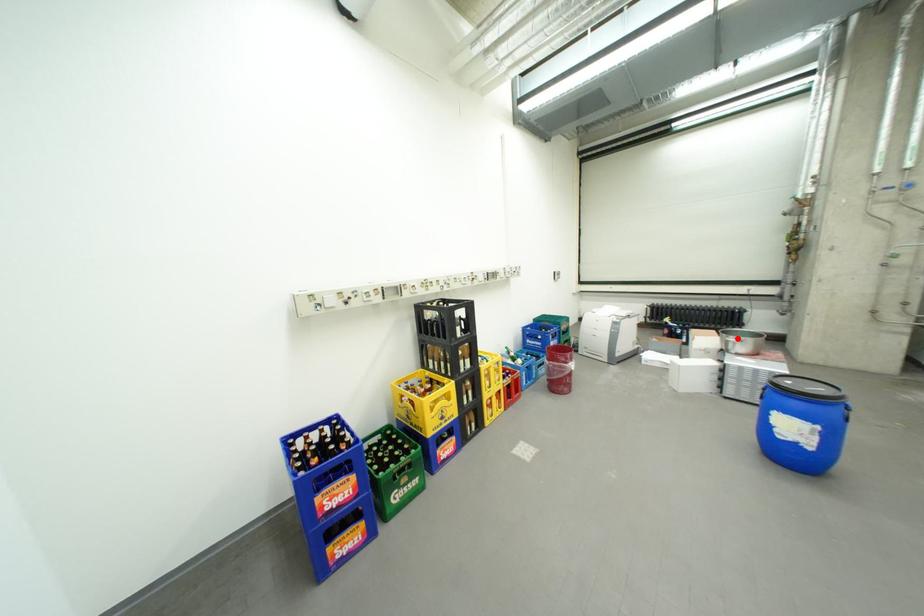
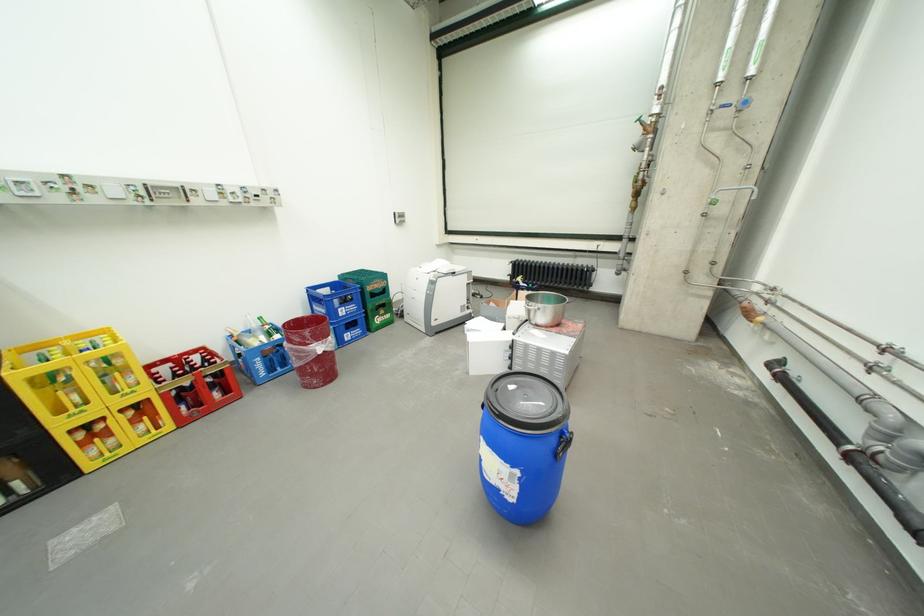
Where in the second image is the point corresponding to the highlighted location from the first image?

(540, 304)